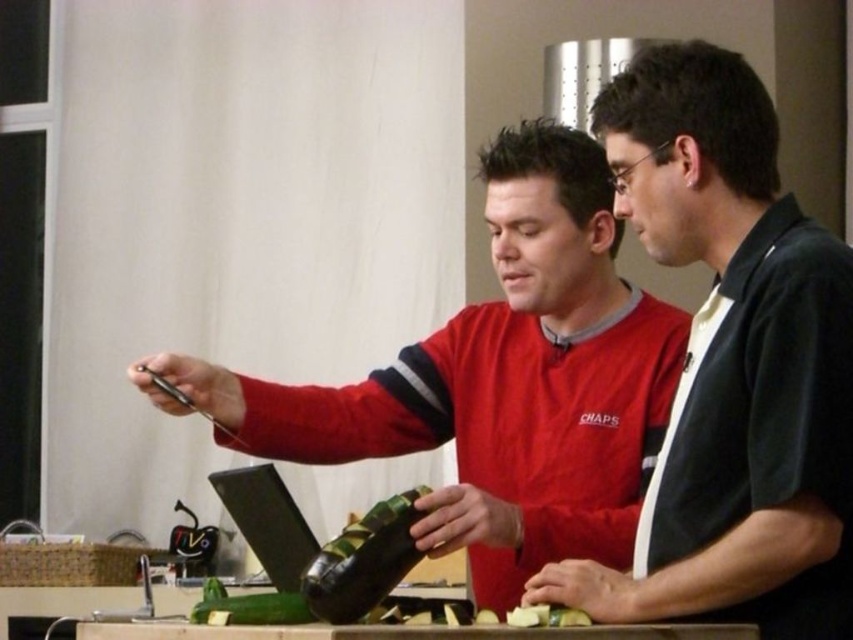
Is green matte bottle at center wider than green matte cucumber at center?

No, green matte bottle at center is not wider than green matte cucumber at center.

Who is positioned more to the right, green matte bottle at center or green matte cucumber at center?

Positioned to the right is green matte cucumber at center.

Between point (370, 602) and point (456, 621), which one is positioned behind?

The point (370, 602) is behind.

In order to click on green matte bottle at center in this screenshot , I will do `click(363, 561)`.

Can you confirm if black matte shirt at center is positioned above green matte bottle at center?

Correct, black matte shirt at center is located above green matte bottle at center.

Can you confirm if black matte shirt at center is positioned below green matte bottle at center?

No, black matte shirt at center is not below green matte bottle at center.

Image resolution: width=853 pixels, height=640 pixels. Find the location of `black matte shirt at center`. black matte shirt at center is located at coordinates (730, 365).

The height and width of the screenshot is (640, 853). What are the coordinates of `black matte shirt at center` in the screenshot? It's located at (730, 365).

Does red fabric shirt at center have a lesser height compared to green matte cucumber at center?

In fact, red fabric shirt at center may be taller than green matte cucumber at center.

Which of these two, red fabric shirt at center or green matte cucumber at center, stands shorter?

With less height is green matte cucumber at center.

Between point (476, 486) and point (532, 612), which one is positioned in front?

Positioned in front is point (532, 612).

I want to click on red fabric shirt at center, so click(498, 381).